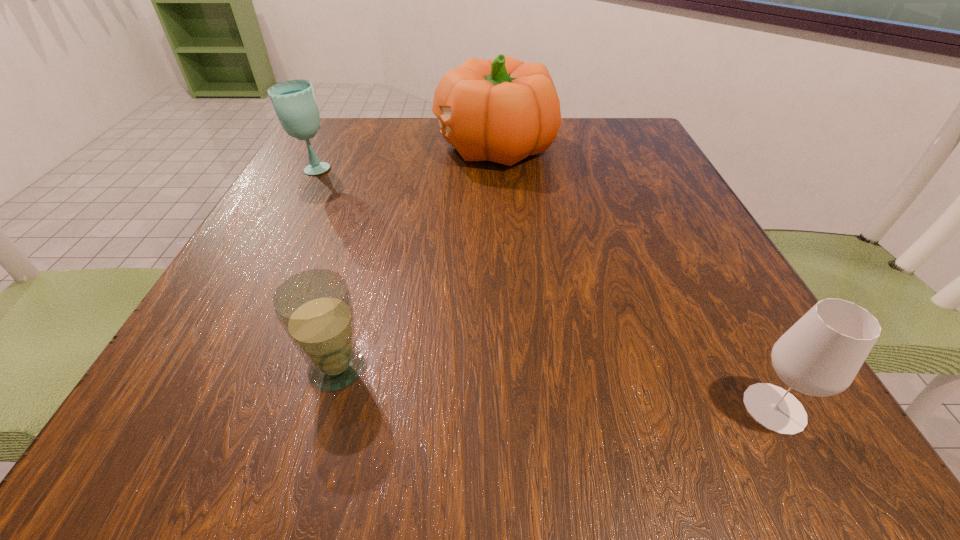
At what (x,y) coordinates should I click in order to perform the action: click on vacant space at the near edge of the desktop. Please return your answer as a coordinate pair (x, y). The image size is (960, 540). Looking at the image, I should click on (648, 429).

You are a GUI agent. You are given a task and a screenshot of the screen. Output one action in this format:
    pyautogui.click(x=<x>, y=<y>)
    Task: Click on the vacant space at the left edge of the desktop
    Image resolution: width=960 pixels, height=540 pixels.
    Given the screenshot: What is the action you would take?
    pyautogui.click(x=291, y=227)

This screenshot has width=960, height=540. In the image, there is a desktop. Identify the location of vacant space at the right edge. (733, 288).

The image size is (960, 540). In the image, there is a desktop. What are the coordinates of `free space at the far left corner` in the screenshot? It's located at (352, 147).

In the image, there is a desktop. At what (x,y) coordinates should I click in order to perform the action: click on vacant space at the near left corner. Please return your answer as a coordinate pair (x, y). The width and height of the screenshot is (960, 540). Looking at the image, I should click on (209, 424).

The height and width of the screenshot is (540, 960). What are the coordinates of `free region at the far right corner of the desktop` in the screenshot? It's located at (648, 153).

Find the location of a particular element. The width and height of the screenshot is (960, 540). free space that is in between the pumpkin and the farthest glass is located at coordinates (403, 158).

This screenshot has width=960, height=540. What are the coordinates of `vacant point located between the rightmost glass and the pumpkin` in the screenshot? It's located at (635, 278).

At what (x,y) coordinates should I click in order to perform the action: click on free space between the farthest glass and the second glass from right to left. Please return your answer as a coordinate pair (x, y). Image resolution: width=960 pixels, height=540 pixels. Looking at the image, I should click on (325, 269).

The height and width of the screenshot is (540, 960). I want to click on free space between the third object from left to right and the shortest object, so click(x=416, y=258).